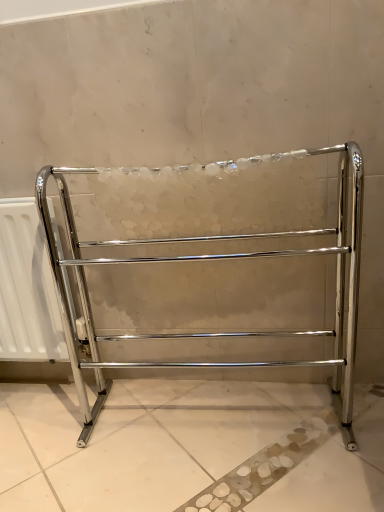
Question: From the image's perspective, relative to white matte radiator at left, is polished chrome towel rack at center above or below?

Choices:
 (A) above
 (B) below

Answer: (A)

Question: In terms of width, does polished chrome towel rack at center look wider or thinner when compared to white matte radiator at left?

Choices:
 (A) thin
 (B) wide

Answer: (B)

Question: Is point (340, 340) closer or farther from the camera than point (0, 314)?

Choices:
 (A) farther
 (B) closer

Answer: (B)

Question: In the image, is white matte radiator at left positioned in front of or behind polished chrome towel rack at center?

Choices:
 (A) front
 (B) behind

Answer: (B)

Question: From the image's perspective, is white matte radiator at left positioned above or below polished chrome towel rack at center?

Choices:
 (A) below
 (B) above

Answer: (A)

Question: Does point (31, 316) appear closer or farther from the camera than point (112, 259)?

Choices:
 (A) closer
 (B) farther

Answer: (B)

Question: From a real-world perspective, is white matte radiator at left physically located above or below polished chrome towel rack at center?

Choices:
 (A) above
 (B) below

Answer: (B)